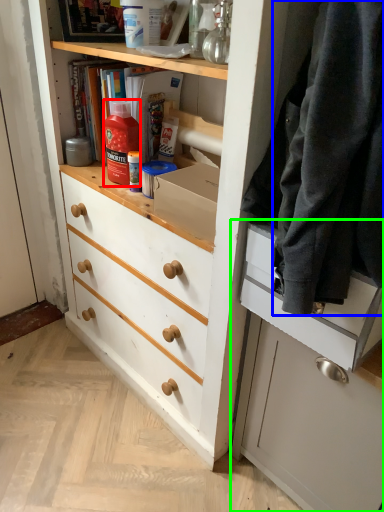
Question: Which object is the farthest from bottle (highlighted by a red box)? Choose among these: clothing (highlighted by a blue box) or cabinetry (highlighted by a green box).

Choices:
 (A) clothing
 (B) cabinetry

Answer: (B)